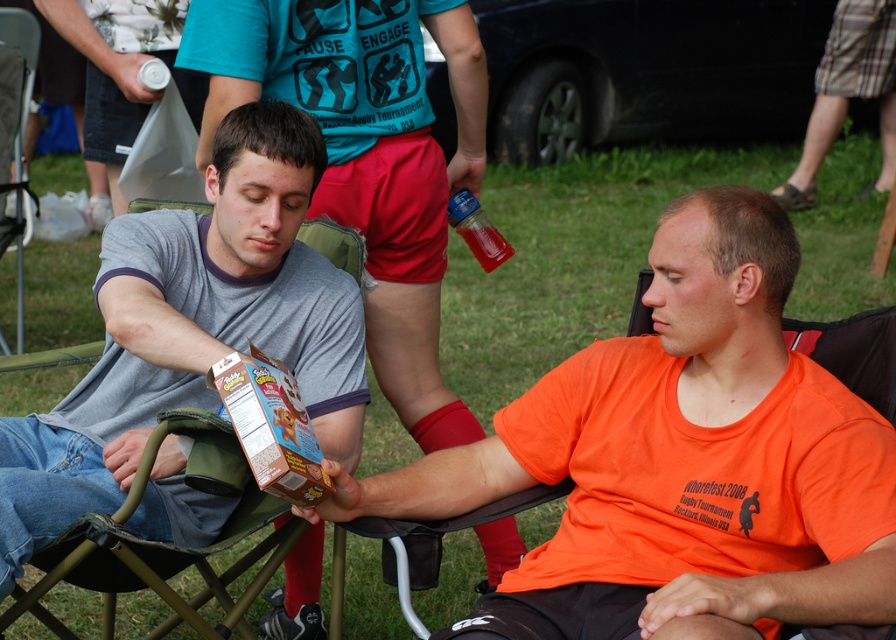
Question: Is matte gray shirt at center wider than translucent plastic bottle at upper center?

Choices:
 (A) no
 (B) yes

Answer: (B)

Question: Considering the real-world distances, which object is farthest from the gray cotton shirt at left?

Choices:
 (A) orange matte shirt at center
 (B) matte gray shirt at center

Answer: (A)

Question: Considering the relative positions of matte gray shirt at center and translucent plastic bottle at upper center in the image provided, where is matte gray shirt at center located with respect to translucent plastic bottle at upper center?

Choices:
 (A) right
 (B) left

Answer: (B)

Question: Which of these objects is positioned closest to the orange matte shirt at center?

Choices:
 (A) matte gray shirt at center
 (B) translucent plastic bottle at upper center

Answer: (A)

Question: Is matte gray shirt at center above translucent plastic bottle at upper center?

Choices:
 (A) yes
 (B) no

Answer: (A)

Question: Which object is positioned closest to the gray cotton shirt at left?

Choices:
 (A) translucent plastic bottle at upper center
 (B) orange matte shirt at center
 (C) matte gray shirt at center

Answer: (C)